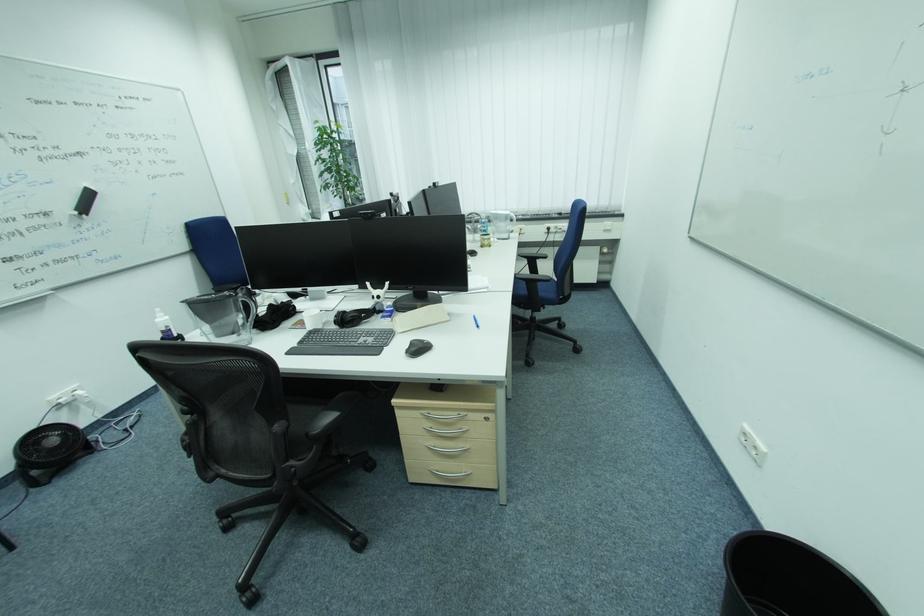
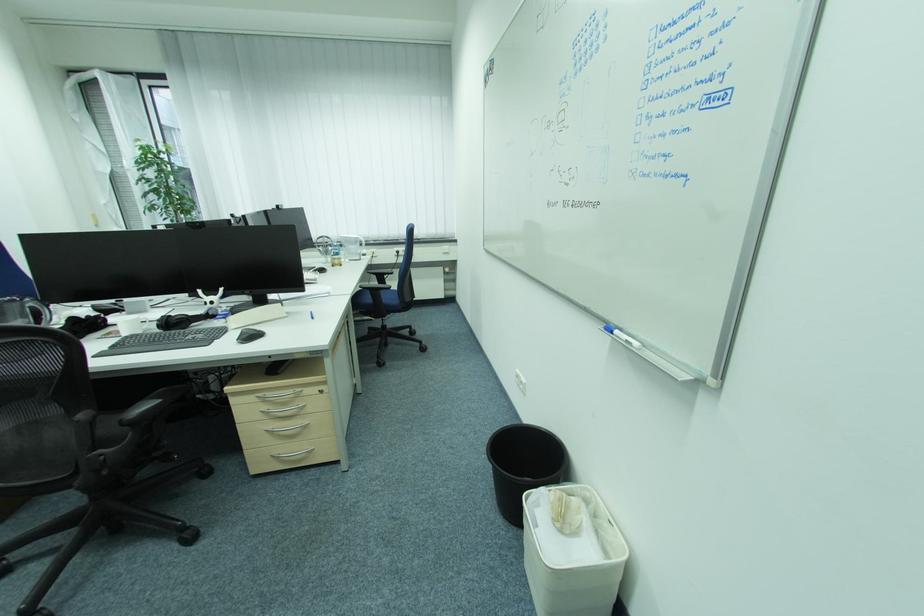
Where in the second image is the point corresponding to (434,426) from the first image?

(272, 408)